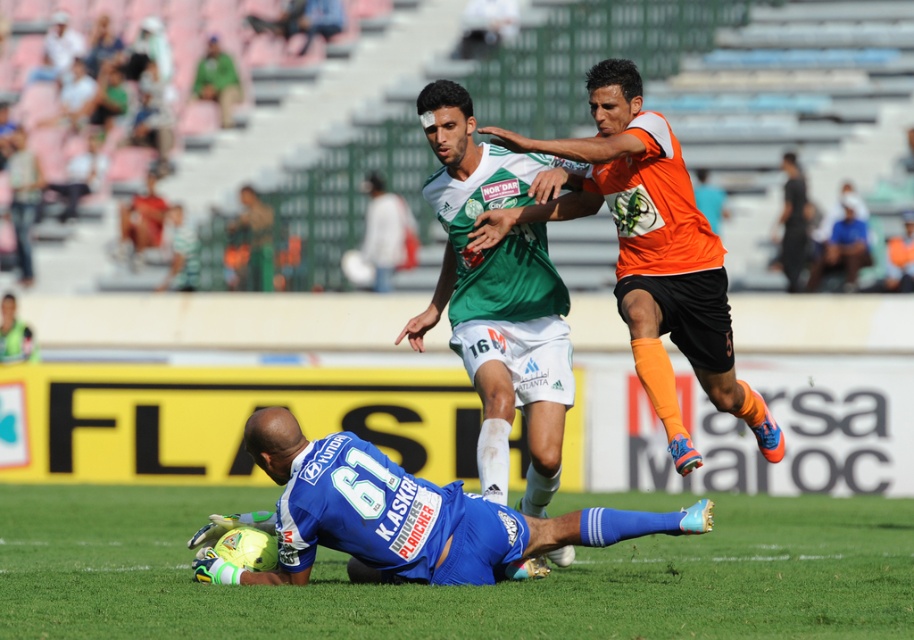
Question: Among these points, which one is farthest from the camera?

Choices:
 (A) coord(324,506)
 (B) coord(562,556)
 (C) coord(771,636)
 (D) coord(576,140)

Answer: (B)

Question: Among these points, which one is farthest from the camera?

Choices:
 (A) (700, 241)
 (B) (525, 500)
 (C) (135, 568)
 (D) (667, 516)

Answer: (C)

Question: Does green grass at lower center have a smaller size compared to green jersey at center?

Choices:
 (A) yes
 (B) no

Answer: (B)

Question: Is orange jersey at upper right thinner than blue jersey at lower center?

Choices:
 (A) no
 (B) yes

Answer: (B)

Question: Is green jersey at center further to camera compared to blue jersey at lower center?

Choices:
 (A) yes
 (B) no

Answer: (A)

Question: Based on their relative distances, which object is farther from the blue jersey at lower center?

Choices:
 (A) green grass at lower center
 (B) orange jersey at upper right

Answer: (A)